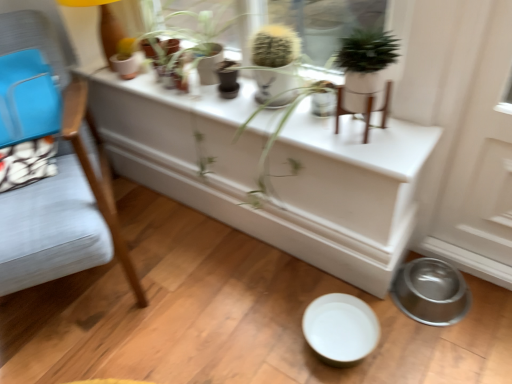
The image size is (512, 384). In order to click on vacant area that is in front of fuzzy green cactus at upper center, which is the second houseplant in right-to-left order in this screenshot , I will do `click(304, 121)`.